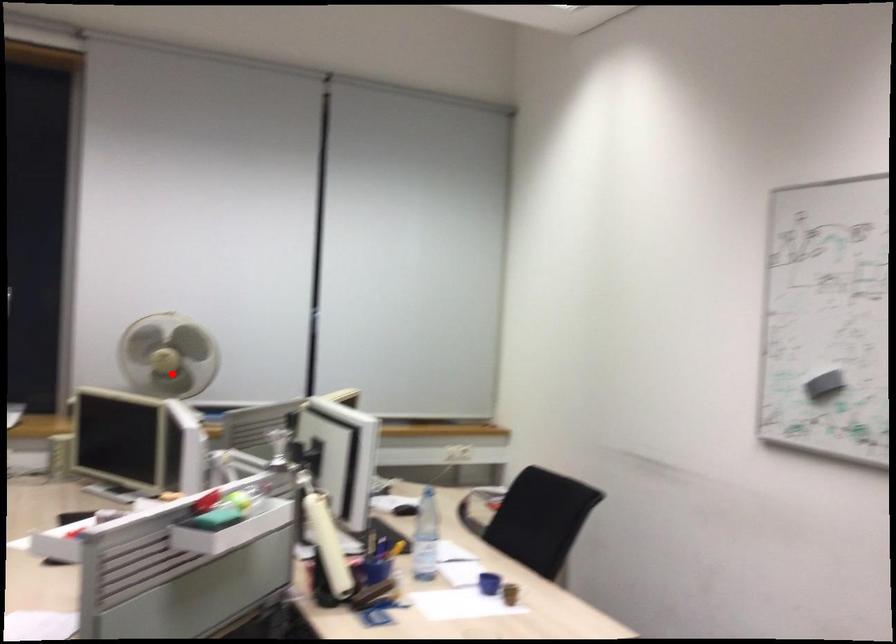
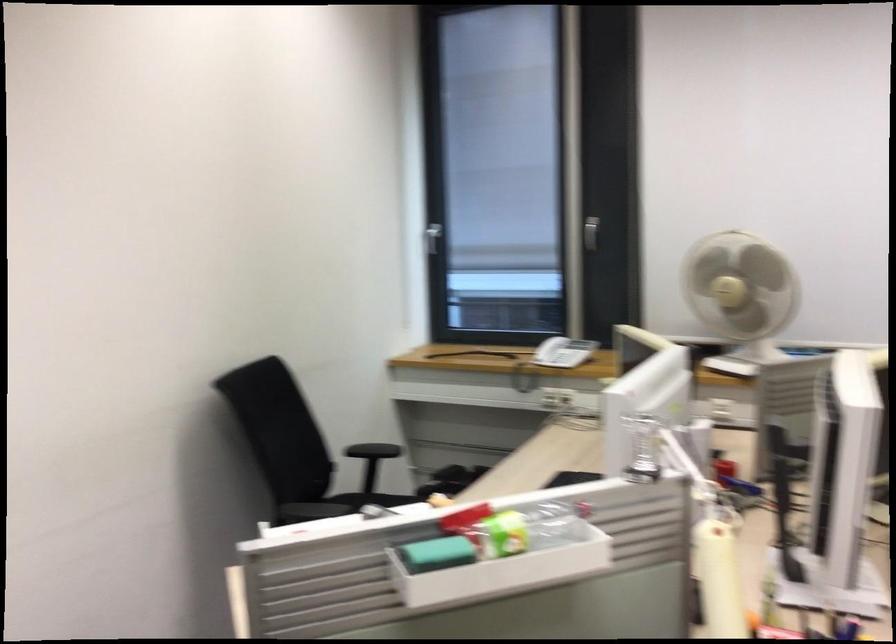
Question: I am providing you with two images of the same scene from different viewpoints. Image1 has a red point marked. In image2, the corresponding 3D location appears at what relative position? Reply with the corresponding letter.

Choices:
 (A) Closer
 (B) Farther

Answer: (A)